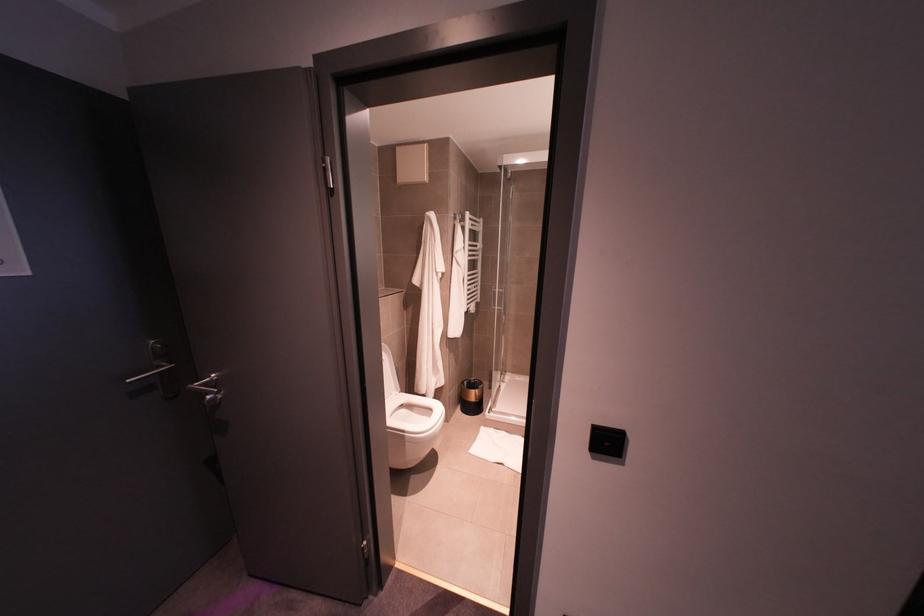
Find where to push the silver door handle. Please return your answer as a coordinate pair (x, y).

(207, 391)